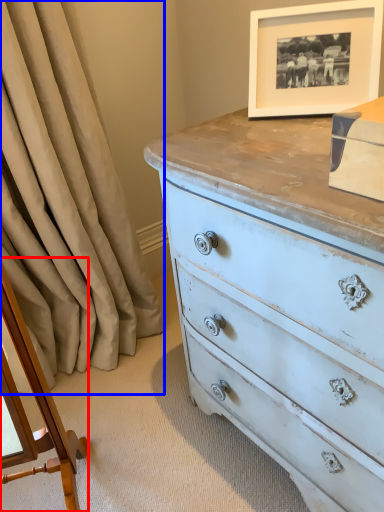
Question: Which point is further to the camera, changing table (highlighted by a red box) or curtain (highlighted by a blue box)?

Choices:
 (A) changing table
 (B) curtain

Answer: (B)